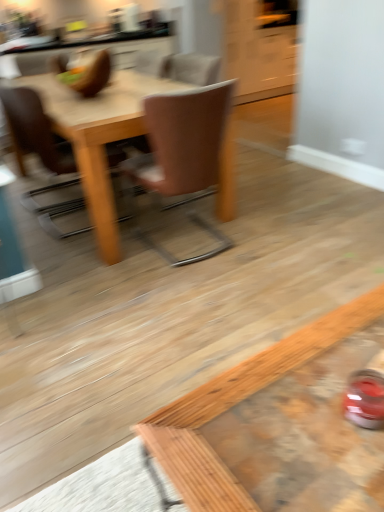
Question: Should I look upward or downward to see light brown wooden table at center?

Choices:
 (A) up
 (B) down

Answer: (A)

Question: Considering the relative sizes of brown leather chair at center, which is the 2th chair from left to right, and wooden coffee table at lower right in the image provided, is brown leather chair at center, which is the 2th chair from left to right, smaller than wooden coffee table at lower right?

Choices:
 (A) yes
 (B) no

Answer: (B)

Question: Considering the relative positions of brown leather chair at center, which is the first chair from right to left, and wooden coffee table at lower right in the image provided, is brown leather chair at center, which is the first chair from right to left, to the right of wooden coffee table at lower right from the viewer's perspective?

Choices:
 (A) no
 (B) yes

Answer: (A)

Question: Is the position of brown leather chair at center, which is the 2th chair from left to right, more distant than that of wooden coffee table at lower right?

Choices:
 (A) no
 (B) yes

Answer: (B)

Question: Could you tell me if brown leather chair at center, which is the 2th chair from left to right, is turned towards wooden coffee table at lower right?

Choices:
 (A) yes
 (B) no

Answer: (B)

Question: From the image's perspective, is brown leather chair at center, which is the 2th chair from left to right, located above wooden coffee table at lower right?

Choices:
 (A) no
 (B) yes

Answer: (B)

Question: Is brown leather chair at center, which is the first chair from right to left, at the left side of wooden coffee table at lower right?

Choices:
 (A) no
 (B) yes

Answer: (B)

Question: Considering the relative positions of wooden coffee table at lower right and light brown wooden table at center in the image provided, is wooden coffee table at lower right to the left of light brown wooden table at center from the viewer's perspective?

Choices:
 (A) no
 (B) yes

Answer: (A)

Question: Considering the relative positions of wooden coffee table at lower right and light brown wooden table at center in the image provided, is wooden coffee table at lower right to the right of light brown wooden table at center from the viewer's perspective?

Choices:
 (A) yes
 (B) no

Answer: (A)

Question: Is wooden coffee table at lower right shorter than light brown wooden table at center?

Choices:
 (A) no
 (B) yes

Answer: (B)

Question: Is wooden coffee table at lower right beside light brown wooden table at center?

Choices:
 (A) yes
 (B) no

Answer: (B)

Question: From a real-world perspective, is wooden coffee table at lower right beneath light brown wooden table at center?

Choices:
 (A) yes
 (B) no

Answer: (A)

Question: From a real-world perspective, is wooden coffee table at lower right on top of light brown wooden table at center?

Choices:
 (A) no
 (B) yes

Answer: (A)

Question: Does wooden coffee table at lower right have a smaller size compared to brown leather chair at upper left, the first chair in the left-to-right sequence?

Choices:
 (A) no
 (B) yes

Answer: (B)